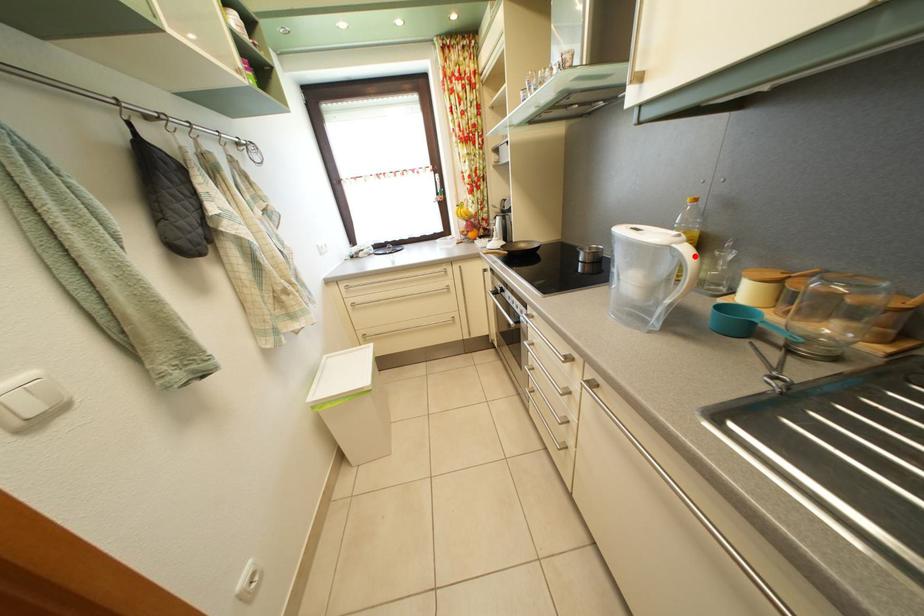
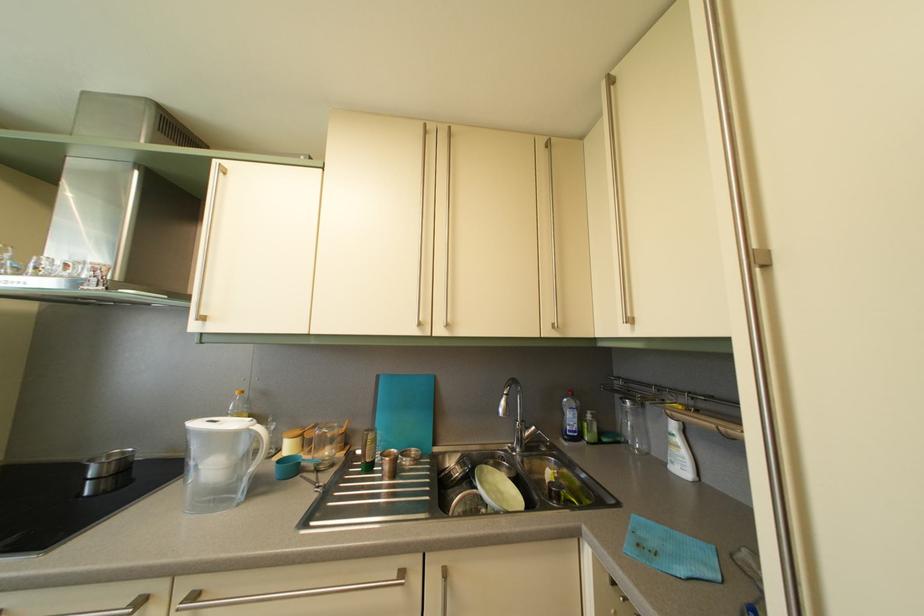
Locate, in the second image, the point that corresponds to the highlighted location in the first image.

(266, 436)